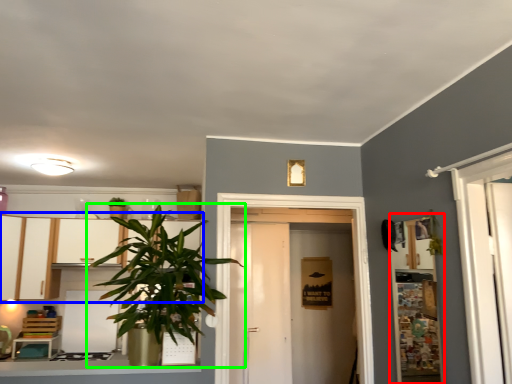
Question: Estimate the real-world distances between objects in this image. Which object is farther from shelf (highlighted by a red box), dresser (highlighted by a blue box) or houseplant (highlighted by a green box)?

Choices:
 (A) dresser
 (B) houseplant

Answer: (A)